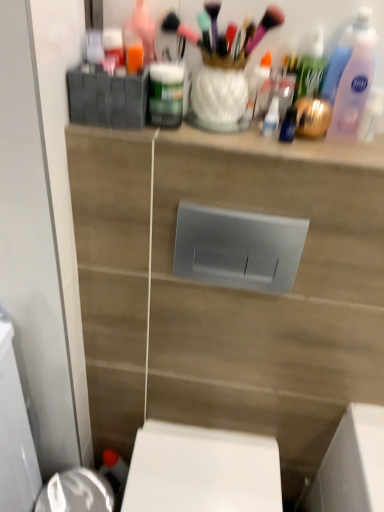
Question: Should I look upward or downward to see matte plastic toiletries at upper center?

Choices:
 (A) up
 (B) down

Answer: (A)

Question: Is pink plastic bottle at upper right positioned with its back to matte plastic toiletries at upper center?

Choices:
 (A) no
 (B) yes

Answer: (A)

Question: From a real-world perspective, is pink plastic bottle at upper right physically above matte plastic toiletries at upper center?

Choices:
 (A) yes
 (B) no

Answer: (A)

Question: Could you tell me if pink plastic bottle at upper right is turned towards matte plastic toiletries at upper center?

Choices:
 (A) yes
 (B) no

Answer: (B)

Question: From a real-world perspective, does pink plastic bottle at upper right sit lower than matte plastic toiletries at upper center?

Choices:
 (A) no
 (B) yes

Answer: (A)

Question: Considering the relative sizes of pink plastic bottle at upper right and matte plastic toiletries at upper center in the image provided, is pink plastic bottle at upper right bigger than matte plastic toiletries at upper center?

Choices:
 (A) no
 (B) yes

Answer: (A)

Question: From the image's perspective, is pink plastic bottle at upper right located above matte plastic toiletries at upper center?

Choices:
 (A) no
 (B) yes

Answer: (B)

Question: From the image's perspective, does matte green jar at upper center appear lower than matte plastic toiletries at upper center?

Choices:
 (A) yes
 (B) no

Answer: (B)

Question: Can you confirm if matte green jar at upper center is positioned to the right of matte plastic toiletries at upper center?

Choices:
 (A) no
 (B) yes

Answer: (A)

Question: Is matte green jar at upper center taller than matte plastic toiletries at upper center?

Choices:
 (A) no
 (B) yes

Answer: (B)

Question: Is matte green jar at upper center placed right next to matte plastic toiletries at upper center?

Choices:
 (A) yes
 (B) no

Answer: (B)

Question: Does matte green jar at upper center have a lesser height compared to matte plastic toiletries at upper center?

Choices:
 (A) yes
 (B) no

Answer: (B)

Question: Is matte green jar at upper center to the left of matte plastic toiletries at upper center from the viewer's perspective?

Choices:
 (A) yes
 (B) no

Answer: (A)

Question: From the image's perspective, is matte plastic toiletries at upper center beneath pink plastic bottle at upper right?

Choices:
 (A) no
 (B) yes

Answer: (B)